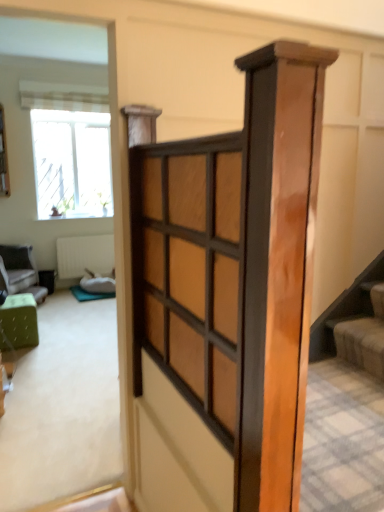
Question: From the image's perspective, relative to clear glass window at upper left, is soft beige carpet at lower right above or below?

Choices:
 (A) above
 (B) below

Answer: (B)

Question: In terms of height, does soft beige carpet at lower right look taller or shorter compared to clear glass window at upper left?

Choices:
 (A) tall
 (B) short

Answer: (B)

Question: Which object is positioned farthest from the clear glass window at upper left?

Choices:
 (A) white textured radiator at center
 (B) green fabric ottoman at left, which is the second furniture in left-to-right order
 (C) green fabric ottoman at left, the 1th furniture from the back
 (D) soft beige carpet at lower right
 (E) wooden barn door at center

Answer: (E)

Question: Which object is positioned closest to the clear glass window at upper left?

Choices:
 (A) soft beige carpet at lower right
 (B) striped fabric curtain at upper left
 (C) wooden barn door at center
 (D) white textured radiator at center
 (E) green fabric ottoman at left, which is the first furniture from front to back

Answer: (B)